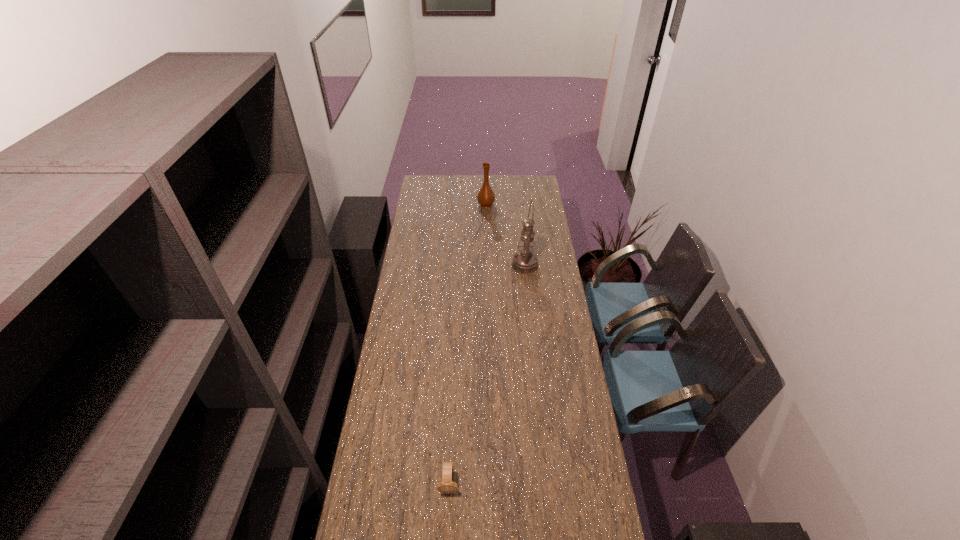
Find the location of a particular element. This screenshot has width=960, height=540. object that is the closest one to the vase is located at coordinates (525, 262).

At what (x,y) coordinates should I click in order to perform the action: click on vacant space that satisfies the following two spatial constraints: 1. on the front side of the rightmost object; 2. on the left side of the vase. Please return your answer as a coordinate pair (x, y). This screenshot has height=540, width=960. Looking at the image, I should click on (487, 265).